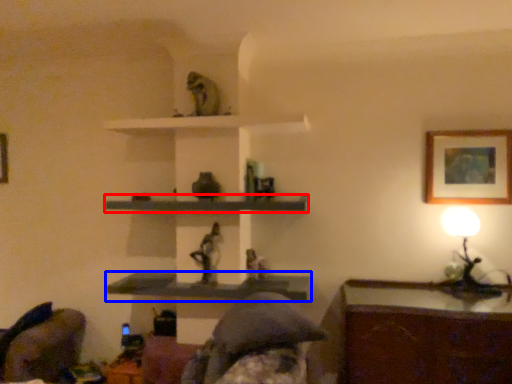
Question: Among these objects, which one is nearest to the camera, shelf (highlighted by a red box) or shelf (highlighted by a blue box)?

Choices:
 (A) shelf
 (B) shelf

Answer: (A)